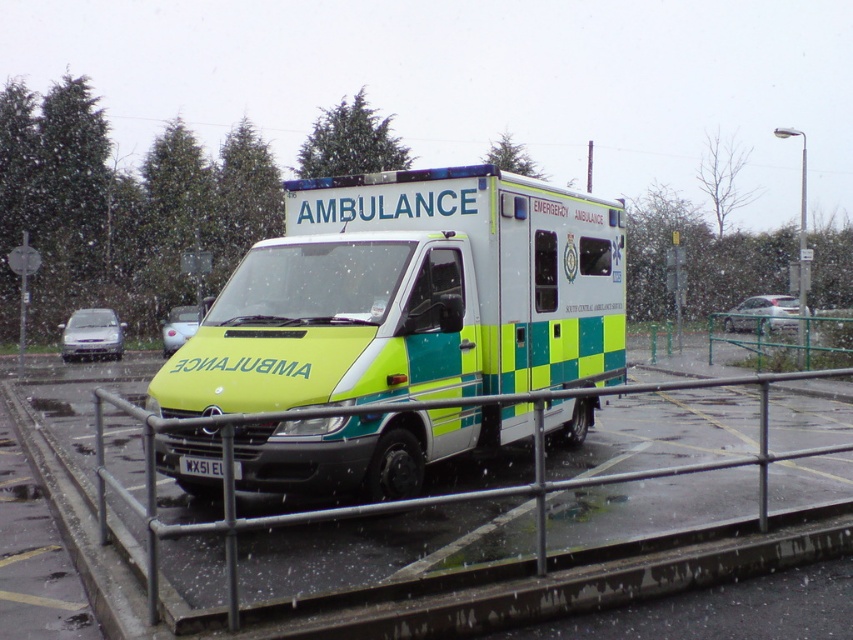
You are standing in front of the parked ambulance and want to know which point is closer to you. The points are point (88, 332) and point (776, 323). Which point is closer to your position?

Point (776, 323) is closer to you because it is less further to the camera than point (88, 332).

In the scene shown: You are a delivery driver who needs to park your van between the silver metallic hatchback at lower left and the metallic silver car at left. The van is 12 feet long. Is there enough space between them to park your van?

The silver metallic hatchback at lower left and the metallic silver car at left are 8.16 feet apart. Since the van is 12 feet long, there is not enough space to park between them.